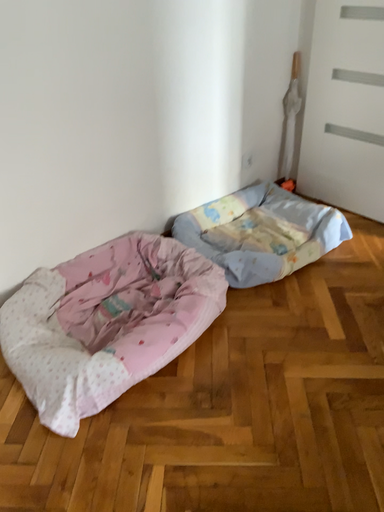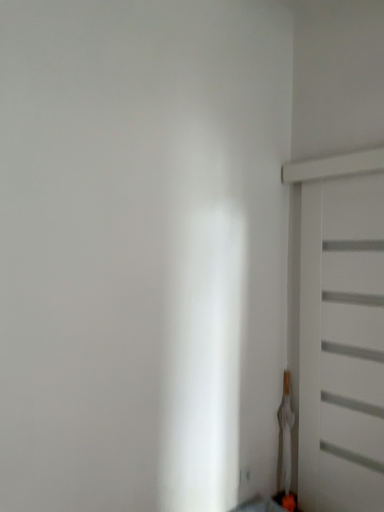
Question: How did the camera likely rotate when shooting the video?

Choices:
 (A) rotated upward
 (B) rotated downward

Answer: (A)